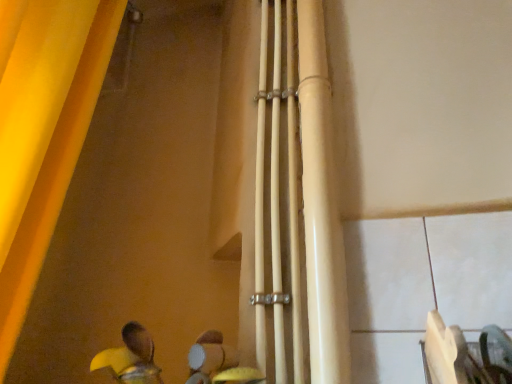
What is the approximate height of matte white pipe at center?

1.10 meters.

In order to face matte white pipe at center, should I rotate leftwards or rightwards?

Result: To align with it, rotate right about 8.167°.

Identify the location of matte white pipe at center. This screenshot has width=512, height=384. (321, 206).

The image size is (512, 384). What do you see at coordinates (321, 206) in the screenshot?
I see `matte white pipe at center` at bounding box center [321, 206].

The image size is (512, 384). Describe the element at coordinates (42, 131) in the screenshot. I see `yellow fabric curtain at left` at that location.

The height and width of the screenshot is (384, 512). Find the location of `yellow fabric curtain at left`. yellow fabric curtain at left is located at coordinates (42, 131).

At what (x,y) coordinates should I click in order to perform the action: click on matte white pipe at center. Please return your answer as a coordinate pair (x, y). Looking at the image, I should click on (321, 206).

Is yellow fabric curtain at left to the left or to the right of matte white pipe at center in the image?

From the image, it's evident that yellow fabric curtain at left is to the left of matte white pipe at center.

Is yellow fabric curtain at left closer to the viewer compared to matte white pipe at center?

Yes, yellow fabric curtain at left is closer to the camera.

Is point (3, 297) positioned in front of point (334, 228)?

No, it is behind (334, 228).

From the image's perspective, which is above, yellow fabric curtain at left or matte white pipe at center?

yellow fabric curtain at left appears higher in the image.

From a real-world perspective, is yellow fabric curtain at left above or below matte white pipe at center?

From a real-world perspective, yellow fabric curtain at left is physically above matte white pipe at center.

Does yellow fabric curtain at left have a lesser width compared to matte white pipe at center?

No, yellow fabric curtain at left is not thinner than matte white pipe at center.

Considering the sizes of objects yellow fabric curtain at left and matte white pipe at center in the image provided, who is taller, yellow fabric curtain at left or matte white pipe at center?

yellow fabric curtain at left is taller.

Considering the sizes of objects yellow fabric curtain at left and matte white pipe at center in the image provided, who is smaller, yellow fabric curtain at left or matte white pipe at center?

With smaller size is matte white pipe at center.

Do you think yellow fabric curtain at left is within matte white pipe at center, or outside of it?

yellow fabric curtain at left cannot be found inside matte white pipe at center.

Can you see yellow fabric curtain at left touching matte white pipe at center?

There is a gap between yellow fabric curtain at left and matte white pipe at center.

Does yellow fabric curtain at left turn towards matte white pipe at center?

Yes, yellow fabric curtain at left is oriented towards matte white pipe at center.

Where is `beam behind the yellow fabric curtain at left`? The width and height of the screenshot is (512, 384). beam behind the yellow fabric curtain at left is located at coordinates pos(321,206).

Considering the positions of objects matte white pipe at center and yellow fabric curtain at left in the image provided, who is more to the right, matte white pipe at center or yellow fabric curtain at left?

From the viewer's perspective, matte white pipe at center appears more on the right side.

Considering the positions of objects matte white pipe at center and yellow fabric curtain at left in the image provided, who is in front, matte white pipe at center or yellow fabric curtain at left?

yellow fabric curtain at left.

Considering the positions of points (335, 262) and (45, 188), is point (335, 262) farther from camera compared to point (45, 188)?

No, (335, 262) is closer to viewer.

From the image's perspective, is matte white pipe at center above yellow fabric curtain at left?

Actually, matte white pipe at center appears below yellow fabric curtain at left in the image.

From a real-world perspective, is matte white pipe at center above or below yellow fabric curtain at left?

matte white pipe at center is below yellow fabric curtain at left.

In terms of width, does matte white pipe at center look wider or thinner when compared to yellow fabric curtain at left?

matte white pipe at center is thinner than yellow fabric curtain at left.

Can you confirm if matte white pipe at center is taller than yellow fabric curtain at left?

In fact, matte white pipe at center may be shorter than yellow fabric curtain at left.

Considering the sizes of objects matte white pipe at center and yellow fabric curtain at left in the image provided, who is bigger, matte white pipe at center or yellow fabric curtain at left?

yellow fabric curtain at left.

Is matte white pipe at center located outside yellow fabric curtain at left?

Yes.

Can you see matte white pipe at center touching yellow fabric curtain at left?

matte white pipe at center and yellow fabric curtain at left are not in contact.

From the picture: Does matte white pipe at center turn towards yellow fabric curtain at left?

No, matte white pipe at center does not turn towards yellow fabric curtain at left.

I want to click on curtain lying in front of the matte white pipe at center, so click(x=42, y=131).

Locate an element on the screen. Image resolution: width=512 pixels, height=384 pixels. curtain above the matte white pipe at center (from a real-world perspective) is located at coordinates (42, 131).

Image resolution: width=512 pixels, height=384 pixels. What are the coordinates of `beam that is behind the yellow fabric curtain at left` in the screenshot? It's located at (321, 206).